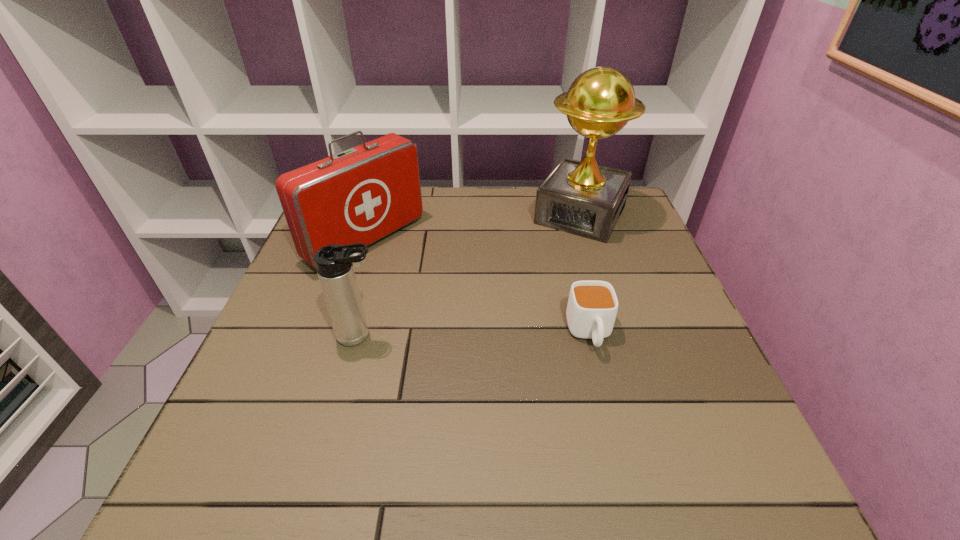
At what (x,y) coordinates should I click in order to perform the action: click on vacant space on the desktop that is between the third tallest object and the shortest object and is positioned on the front-facing side of the tallest object. Please return your answer as a coordinate pair (x, y). The height and width of the screenshot is (540, 960). Looking at the image, I should click on (508, 334).

The width and height of the screenshot is (960, 540). In order to click on free space on the desktop that is between the thermos bottle and the shortest object and is positioned on the side of the third shortest object with the first aid cross symbol in this screenshot , I will do pos(508,334).